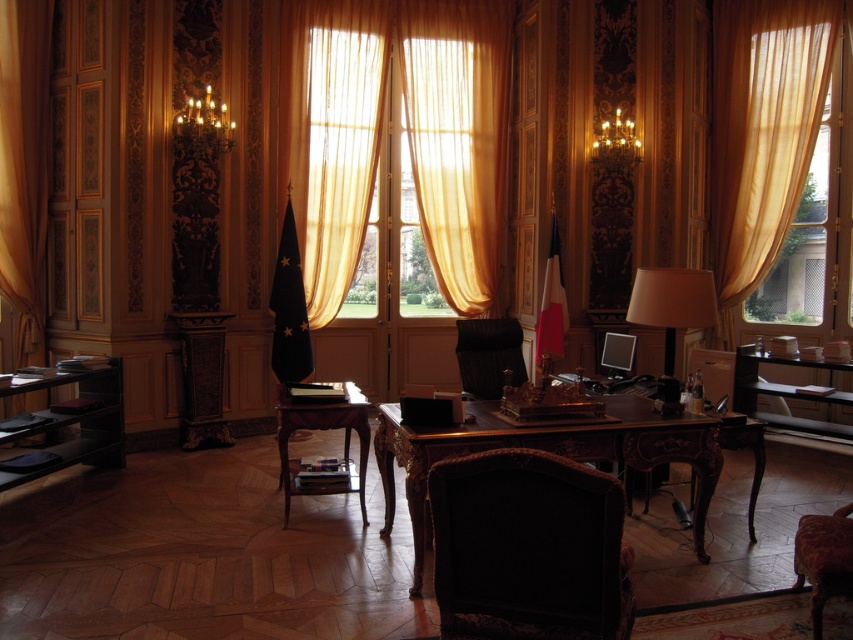
Question: Does velvet dark brown armchair at center appear under golden sheer curtain at left?

Choices:
 (A) no
 (B) yes

Answer: (B)

Question: Can you confirm if mahogany wood desk at center is bigger than wooden desk at lower left?

Choices:
 (A) no
 (B) yes

Answer: (B)

Question: Which point is closer to the camera taking this photo?

Choices:
 (A) (19, 150)
 (B) (415, 484)
 (C) (503, 150)
 (D) (84, 381)

Answer: (B)

Question: Which of the following is the closest to the observer?

Choices:
 (A) (329, 253)
 (B) (509, 344)
 (C) (15, 81)

Answer: (B)

Question: Can you confirm if sheer gold curtains at center is positioned below velvet brown armchair at lower right?

Choices:
 (A) no
 (B) yes

Answer: (A)

Question: Which object is the farthest from the mahogany wood desk at center?

Choices:
 (A) black leather armchair at center
 (B) velvet brown armchair at lower right
 (C) translucent gold curtain at right
 (D) velvet dark brown armchair at center

Answer: (C)